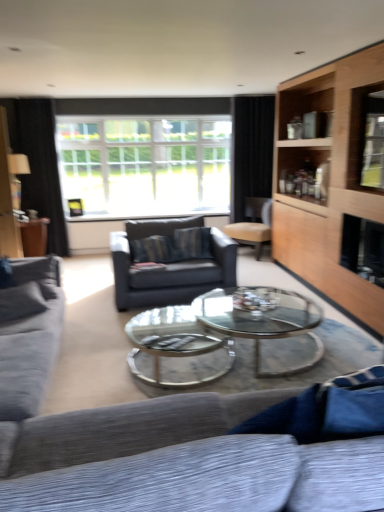
Question: From the image's perspective, is textured gray couch at left, the 2th studio couch viewed from the right, above or below textured gray couch at lower center, which is the first studio couch in right-to-left order?

Choices:
 (A) below
 (B) above

Answer: (B)

Question: Is textured gray couch at left, arranged as the 1th studio couch when viewed from the left, wider or thinner than textured gray couch at lower center, which is the first studio couch in right-to-left order?

Choices:
 (A) thin
 (B) wide

Answer: (A)

Question: Estimate the real-world distances between objects in this image. Which object is closer to the textured gray couch at left, the 2th studio couch viewed from the right?

Choices:
 (A) beige leather chair at center
 (B) black fabric curtain at left, the second curtain when ordered from right to left
 (C) black fabric curtain at upper right, which ranks as the 2th curtain in left-to-right order
 (D) clear glass coffee table at center
 (E) textured gray couch at lower center, which is the second studio couch in left-to-right order

Answer: (D)

Question: Considering the real-world distances, which object is closest to the textured gray couch at left, arranged as the 1th studio couch when viewed from the left?

Choices:
 (A) black fabric curtain at left, which is the 1th curtain from left to right
 (B) light wood cabinet at right
 (C) dark gray fabric swivel chair at center
 (D) clear glass coffee table at center
 (E) clear glass window at center

Answer: (D)